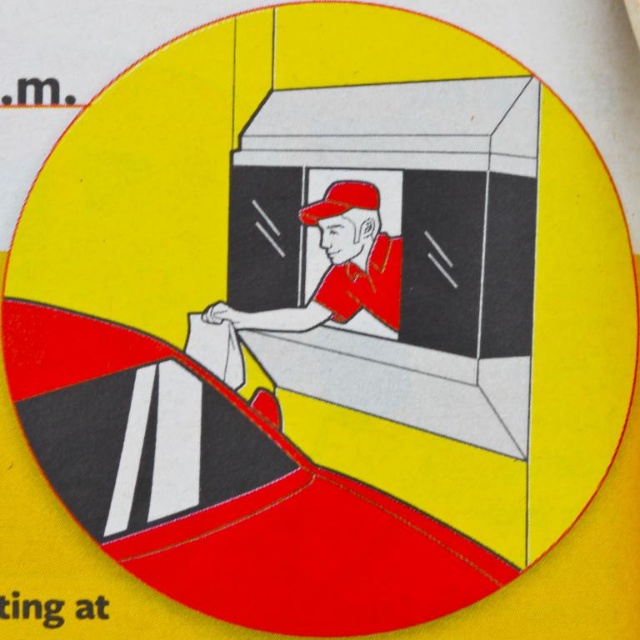
You are a customer at the service station and want to know where the red matte baseball cap at center is relative to the matte red uniform at center. Can you tell me its position?

The matte red uniform at center is positioned on the left side of the red matte baseball cap at center, which means the red matte baseball cap at center is on the right side of the matte red uniform at center.

You are standing at the service station window. There is a point marked at coordinates point (x=339, y=269). What object is located at that point?

The point (x=339, y=269) corresponds to the location of the matte red uniform at center.

You are a customer at the service station and want to hand over a payment to the attendant. Which object, the matte red uniform at center or the red matte baseball cap at center, is nearer to you when you approach the window?

The matte red uniform at center is closer to the viewer than the red matte baseball cap at center, so the matte red uniform at center is nearer to you when you approach the window.